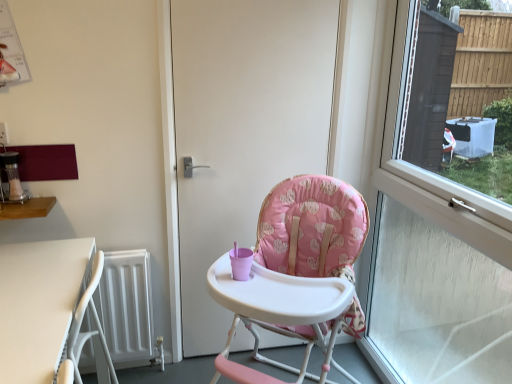
What do you see at coordinates (128, 308) in the screenshot? I see `white matte radiator at lower left` at bounding box center [128, 308].

This screenshot has width=512, height=384. Describe the element at coordinates (242, 128) in the screenshot. I see `white matte door at center` at that location.

The width and height of the screenshot is (512, 384). What do you see at coordinates (433, 257) in the screenshot?
I see `transparent glass window at right` at bounding box center [433, 257].

This screenshot has width=512, height=384. Describe the element at coordinates (312, 228) in the screenshot. I see `pink fabric highchair at center` at that location.

Identify the location of pink fabric highchair at center. This screenshot has height=384, width=512. (312, 228).

Where is `wooden table at left, which ranks as the first table in top-to-bottom order`? wooden table at left, which ranks as the first table in top-to-bottom order is located at coordinates (27, 208).

Would you say white plastic table at lower left, the 1th table ordered from the bottom, contains white matte door at center?

That's incorrect, white matte door at center is not inside white plastic table at lower left, the 1th table ordered from the bottom.

Which is nearer, (49, 333) or (305, 171)?

Clearly, point (49, 333) is closer to the camera than point (305, 171).

From a real-world perspective, who is located higher, white plastic table at lower left, the 1th table ordered from the bottom, or white matte door at center?

In real-world perspective, white matte door at center is above.

Which object is closer to the camera, white plastic table at lower left, the 1th table ordered from the bottom, or white matte door at center?

white plastic table at lower left, the 1th table ordered from the bottom.

Is transparent glass window at right oriented towards white matte door at center?

Yes, transparent glass window at right is oriented towards white matte door at center.

Which of these two, transparent glass window at right or white matte door at center, stands taller?

transparent glass window at right is taller.

Does transparent glass window at right have a lesser width compared to white matte door at center?

No, transparent glass window at right is not thinner than white matte door at center.

Between point (27, 210) and point (0, 334), which one is positioned behind?

The point (27, 210) is farther from the camera.

Looking at this image, from a real-world perspective, is wooden table at left, the 2th table when ordered from bottom to top, over white plastic table at lower left, the 1th table ordered from the bottom?

Correct, in the physical world, wooden table at left, the 2th table when ordered from bottom to top, is higher than white plastic table at lower left, the 1th table ordered from the bottom.

Does wooden table at left, the 2th table when ordered from bottom to top, appear on the right side of white plastic table at lower left, the 2th table when ordered from top to bottom?

No.

Measure the distance from white plastic table at lower left, the 1th table ordered from the bottom, to white matte radiator at lower left.

white plastic table at lower left, the 1th table ordered from the bottom, and white matte radiator at lower left are 18.92 inches apart from each other.

Between white plastic table at lower left, the 2th table when ordered from top to bottom, and white matte radiator at lower left, which one has more height?

With more height is white plastic table at lower left, the 2th table when ordered from top to bottom.

Locate an element on the screen. Image resolution: width=512 pixels, height=384 pixels. radiator above the white plastic table at lower left, the 2th table when ordered from top to bottom (from the image's perspective) is located at coordinates (128, 308).

Locate an element on the screen. radiator below the wooden table at left, the 2th table when ordered from bottom to top (from the image's perspective) is located at coordinates (128, 308).

Is wooden table at left, the 2th table when ordered from bottom to top, touching white matte radiator at lower left?

No, wooden table at left, the 2th table when ordered from bottom to top, is not in contact with white matte radiator at lower left.

Who is taller, wooden table at left, the 2th table when ordered from bottom to top, or white matte radiator at lower left?

With more height is white matte radiator at lower left.

Which is correct: wooden table at left, the 2th table when ordered from bottom to top, is inside white matte radiator at lower left, or outside of it?

wooden table at left, the 2th table when ordered from bottom to top, is spatially situated outside white matte radiator at lower left.

Are transparent glass window at right and white plastic table at lower left, the 2th table when ordered from top to bottom, beside each other?

transparent glass window at right is not next to white plastic table at lower left, the 2th table when ordered from top to bottom, and they're not touching.

Between transparent glass window at right and white plastic table at lower left, the 2th table when ordered from top to bottom, which one has larger size?

Bigger between the two is transparent glass window at right.

From the image's perspective, is transparent glass window at right under white plastic table at lower left, the 1th table ordered from the bottom?

Actually, transparent glass window at right appears above white plastic table at lower left, the 1th table ordered from the bottom, in the image.

Is pink fabric highchair at center aimed at white matte radiator at lower left?

No, pink fabric highchair at center is not aimed at white matte radiator at lower left.

Which object is positioned more to the right, pink fabric highchair at center or white matte radiator at lower left?

pink fabric highchair at center is more to the right.

Where is `chair that is in front of the white matte radiator at lower left`? This screenshot has height=384, width=512. chair that is in front of the white matte radiator at lower left is located at coordinates (312, 228).

Would you consider pink fabric highchair at center to be distant from white matte radiator at lower left?

No, pink fabric highchair at center is in close proximity to white matte radiator at lower left.

The width and height of the screenshot is (512, 384). In order to click on table that appears below the white matte door at center (from a real-world perspective) in this screenshot , I will do `click(39, 304)`.

Where is `window on the right of white matte door at center`? The height and width of the screenshot is (384, 512). window on the right of white matte door at center is located at coordinates (433, 257).

From the image, which object appears to be farther from wooden table at left, which ranks as the first table in top-to-bottom order, white plastic table at lower left, the 1th table ordered from the bottom, or pink fabric highchair at center?

pink fabric highchair at center is further to wooden table at left, which ranks as the first table in top-to-bottom order.

Estimate the real-world distances between objects in this image. Which object is further from white matte radiator at lower left, white plastic table at lower left, the 2th table when ordered from top to bottom, or pink fabric highchair at center?

Among the two, pink fabric highchair at center is located further to white matte radiator at lower left.

Based on the photo, which object lies further to the anchor point pink fabric highchair at center, white matte door at center or white plastic table at lower left, the 2th table when ordered from top to bottom?

white plastic table at lower left, the 2th table when ordered from top to bottom, is positioned further to the anchor pink fabric highchair at center.

Based on their spatial positions, is white matte radiator at lower left or wooden table at left, the 2th table when ordered from bottom to top, closer to pink fabric highchair at center?

white matte radiator at lower left is positioned closer to the anchor pink fabric highchair at center.

From the image, which object appears to be nearer to transparent glass window at right, wooden table at left, the 2th table when ordered from bottom to top, or pink fabric highchair at center?

pink fabric highchair at center.

Which object lies nearer to the anchor point white matte door at center, transparent glass window at right or pink fabric highchair at center?

pink fabric highchair at center is positioned closer to the anchor white matte door at center.

Considering their positions, is white plastic table at lower left, the 1th table ordered from the bottom, positioned further to white matte radiator at lower left than transparent glass window at right?

The object further to white matte radiator at lower left is transparent glass window at right.

Looking at the image, which one is located further to white matte radiator at lower left, pink fabric highchair at center or wooden table at left, the 2th table when ordered from bottom to top?

The object further to white matte radiator at lower left is pink fabric highchair at center.

Identify the location of table between wooden table at left, which ranks as the first table in top-to-bottom order, and white matte door at center, in the horizontal direction. This screenshot has width=512, height=384. (39, 304).

Image resolution: width=512 pixels, height=384 pixels. In order to click on radiator between wooden table at left, which ranks as the first table in top-to-bottom order, and transparent glass window at right, in the horizontal direction in this screenshot , I will do `click(128, 308)`.

Identify the location of radiator between white plastic table at lower left, the 2th table when ordered from top to bottom, and transparent glass window at right, in the horizontal direction. The image size is (512, 384). (128, 308).

I want to click on door between wooden table at left, which ranks as the first table in top-to-bottom order, and transparent glass window at right, in the horizontal direction, so click(242, 128).